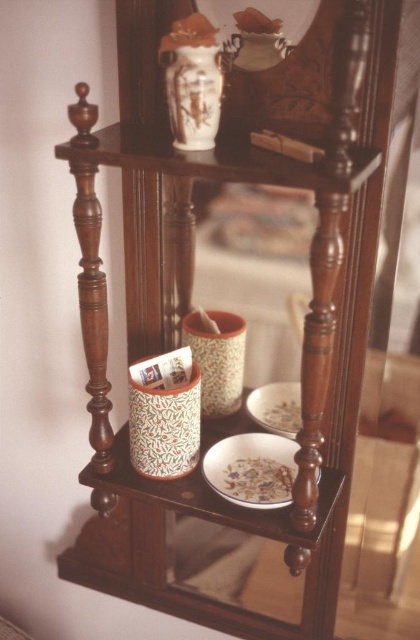
You are standing in front of the wooden shelf unit and want to place a small object on the shelf. If you place it between the two points, point [241,483] and point [286,419], which point will be closer to the front of the shelf unit?

Point [241,483] is in front of point [286,419], so placing the object between them would mean point [241,483] is closer to the front of the shelf unit.

You are standing in front of the wooden shelf unit and want to place a small object on the shelf. You have two options for placement locations marked by point coordinates. Which point, point (168,65) or point (262,387), is closer to you?

Point (168,65) is closer to the viewer than point (262,387), so you should place the object there if you want it nearer to your position.

You are setting up a display on the wooden shelf unit. You have a white glossy plate at center and a white matte bowl at lower center. Which item is taller?

The white glossy plate at center is taller than the white matte bowl at lower center.